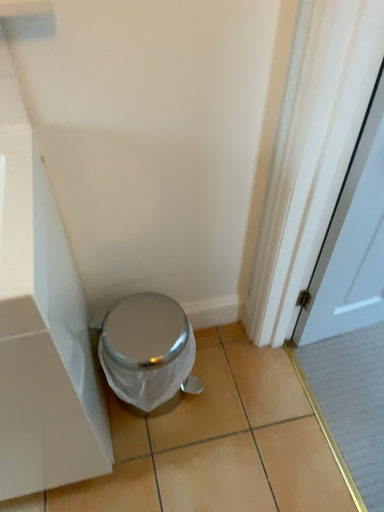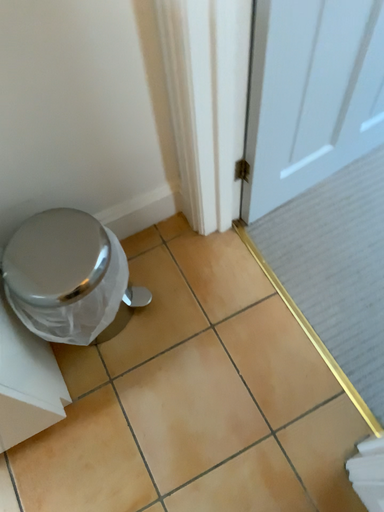
Question: Which way did the camera rotate in the video?

Choices:
 (A) rotated downward
 (B) rotated upward

Answer: (A)